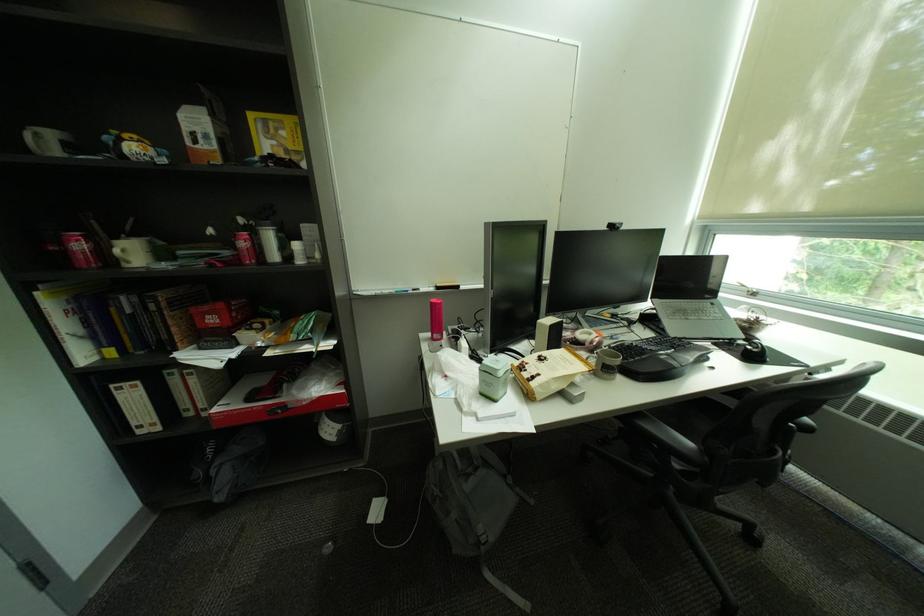
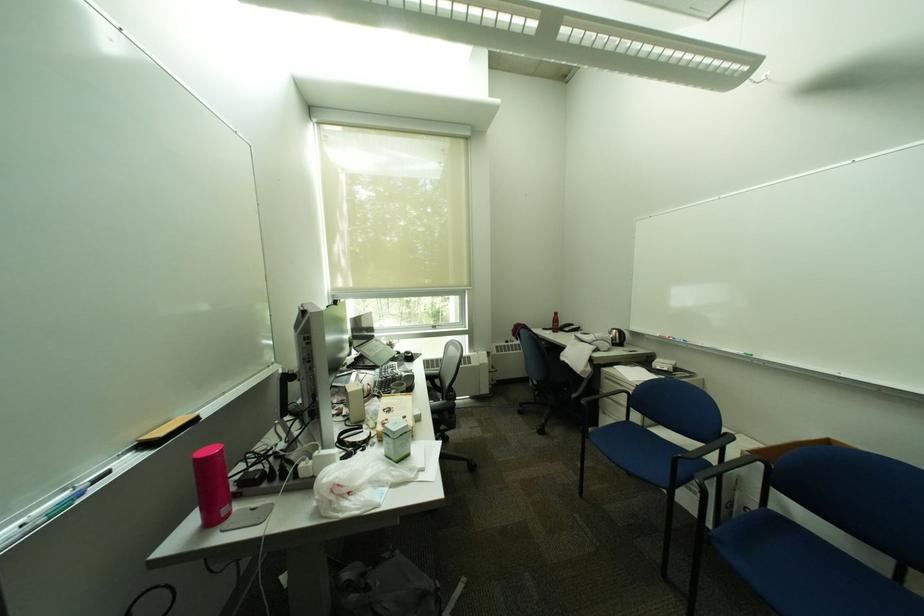
Where in the second image is the point corresponding to pixel 519 487 from the first image?

(400, 560)